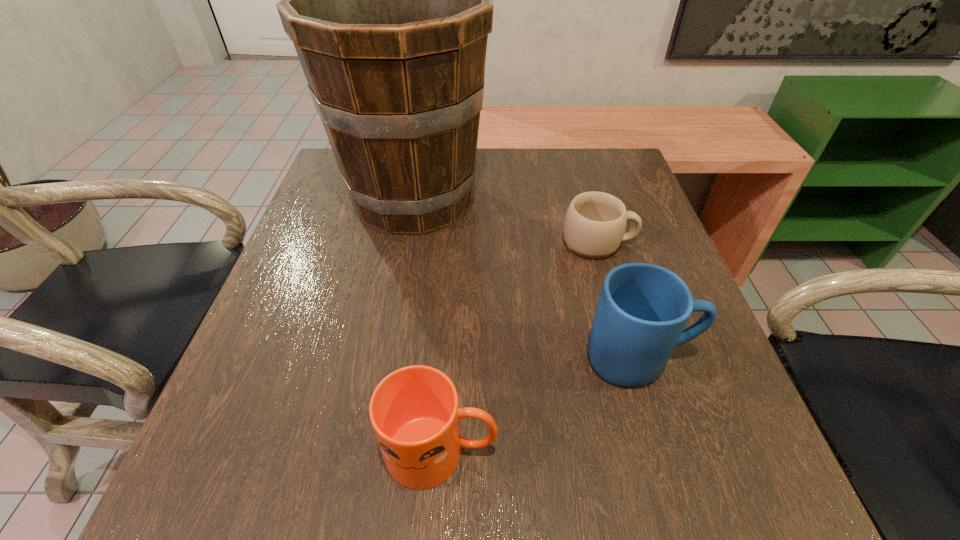
Identify which mug is the second closest to the tallest object. Please provide its 2D coordinates. Your answer should be formatted as a tuple, i.e. [(x, y)], where the tuple contains the x and y coordinates of a point satisfying the conditions above.

[(642, 311)]